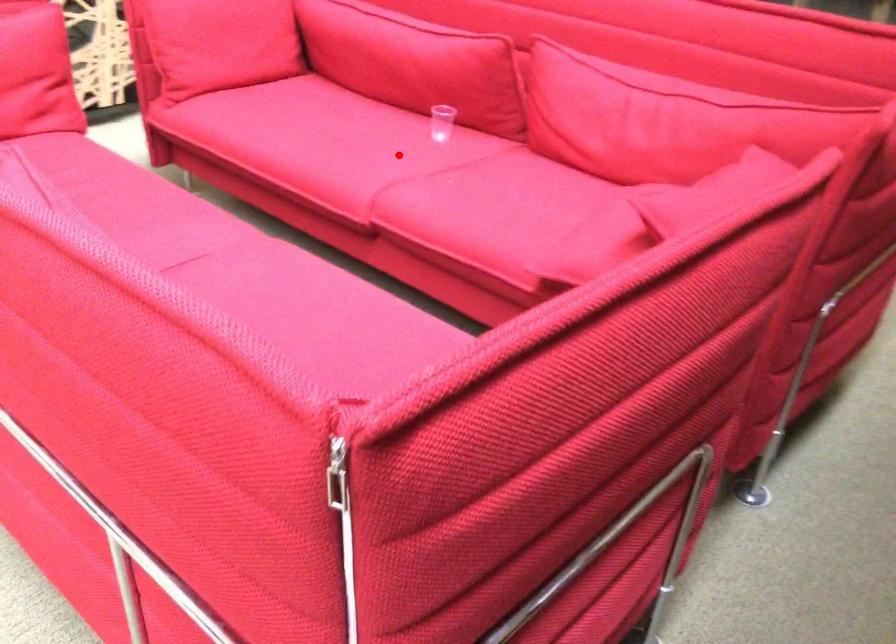
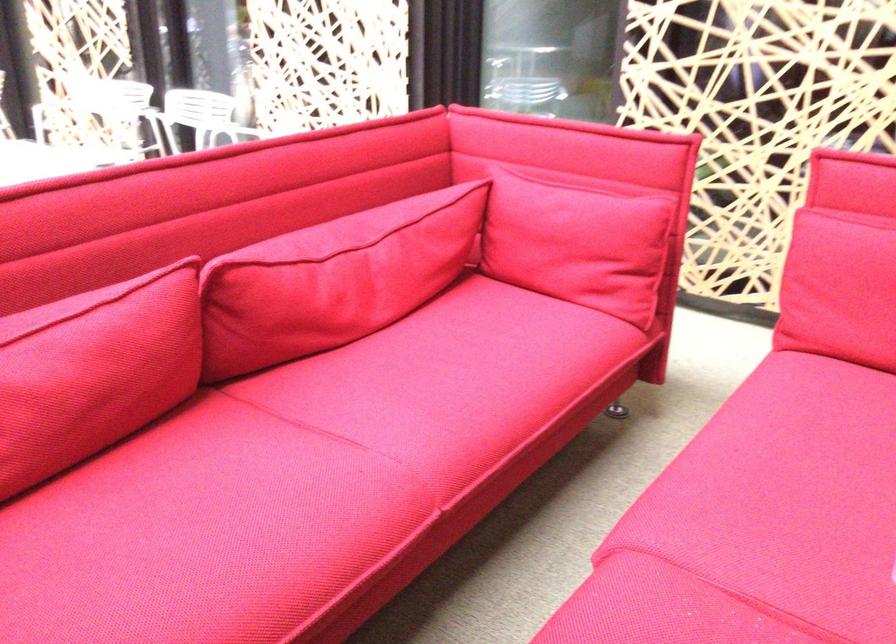
In the second image, find the point that corresponds to the highlighted location in the first image.

(759, 522)